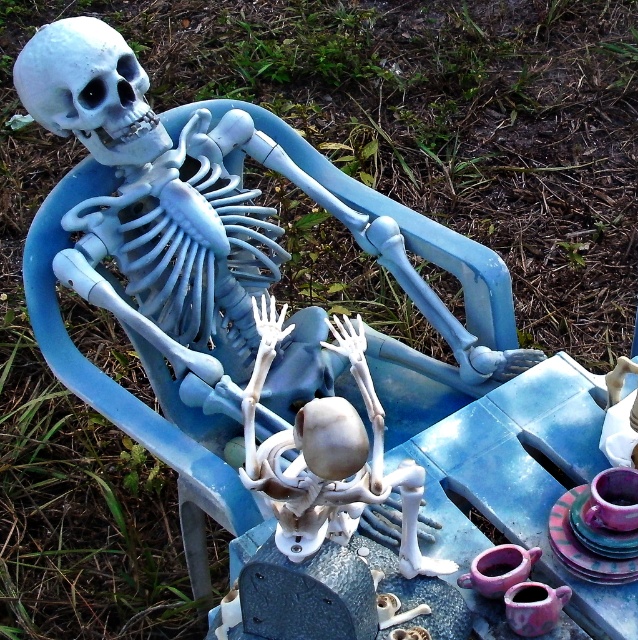
You are standing in the garden and want to place a new decorative item exactly at the coordinates where the white matte skeleton at center is located. What are the coordinates you should target?

The coordinates for the white matte skeleton at center are point [329,456].